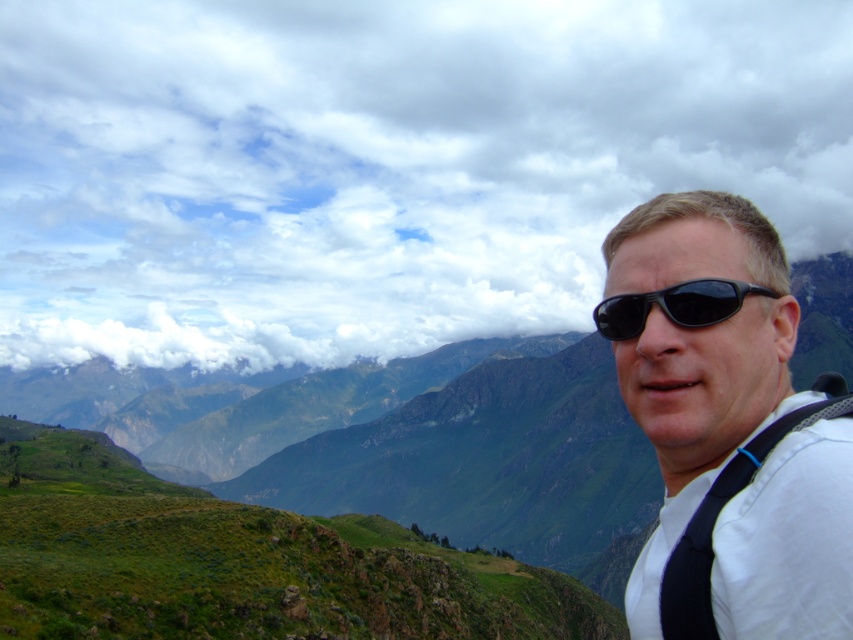
Question: Which object appears farthest from the camera in this image?

Choices:
 (A) black fabric strap at right
 (B) cloudy sky at upper center
 (C) black matte sunglasses at center

Answer: (B)

Question: Is matte black sunglasses at right to the right of black matte sunglasses at center from the viewer's perspective?

Choices:
 (A) no
 (B) yes

Answer: (B)

Question: Which is farther from the matte black sunglasses at right?

Choices:
 (A) black fabric strap at right
 (B) black matte sunglasses at center
 (C) cloudy sky at upper center

Answer: (C)

Question: In this image, where is cloudy sky at upper center located relative to black matte sunglasses at center?

Choices:
 (A) left
 (B) right

Answer: (A)

Question: Which object appears closest to the camera in this image?

Choices:
 (A) cloudy sky at upper center
 (B) matte black sunglasses at right
 (C) black matte sunglasses at center
 (D) black fabric strap at right

Answer: (B)

Question: Does cloudy sky at upper center have a smaller size compared to black fabric strap at right?

Choices:
 (A) no
 (B) yes

Answer: (A)